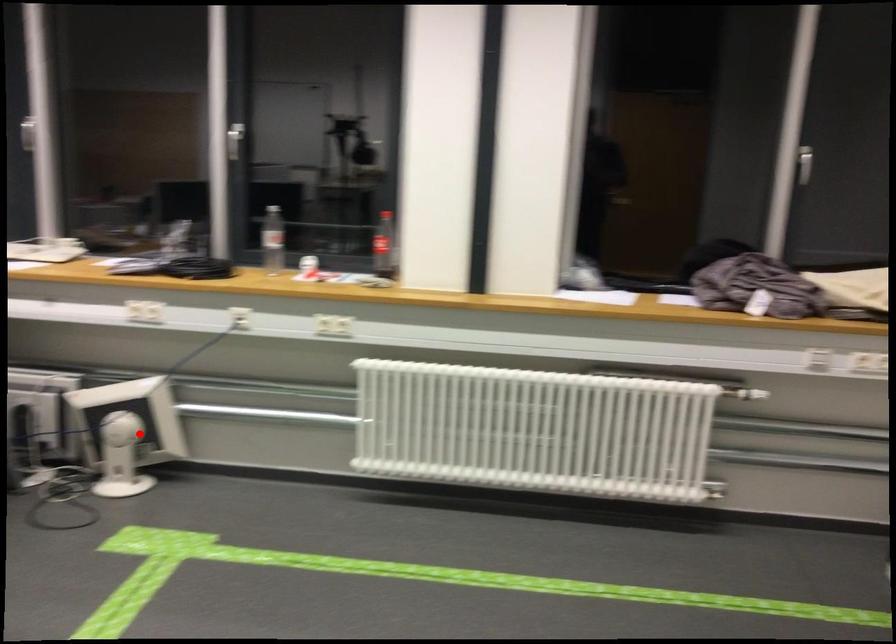
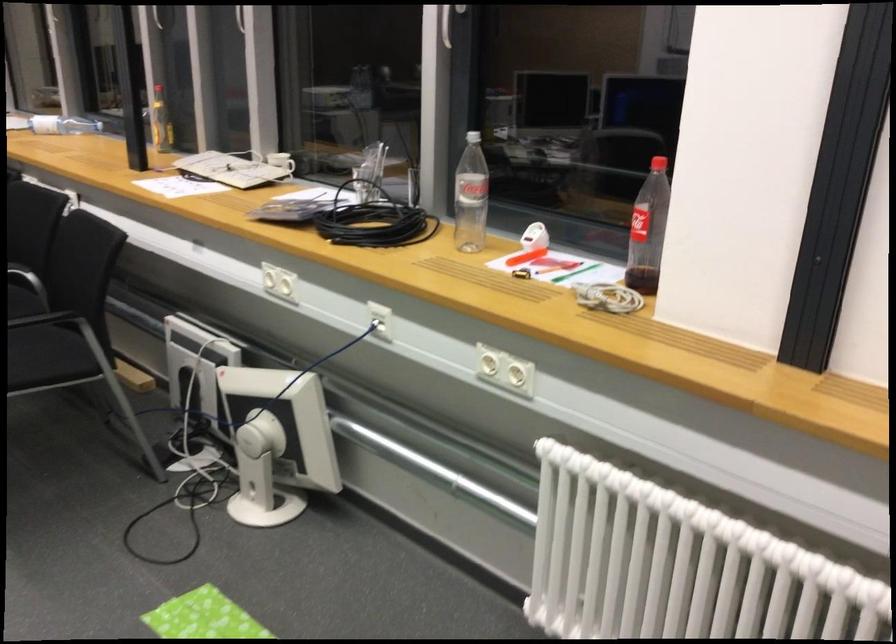
Question: A red point is marked in image1. In image2, is the corresponding 3D point closer to the camera or farther? Reply with the corresponding letter.

Choices:
 (A) The corresponding 3D point is closer.
 (B) The corresponding 3D point is farther.

Answer: (A)